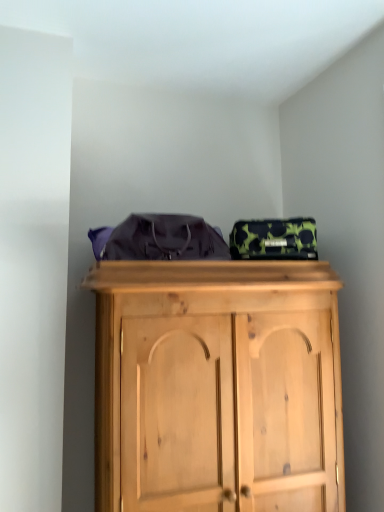
Question: Visually, is matte purple bag at center positioned to the left or to the right of camouflage-patterned fabric bag at upper center?

Choices:
 (A) left
 (B) right

Answer: (A)

Question: Is matte purple bag at center in front of or behind camouflage-patterned fabric bag at upper center in the image?

Choices:
 (A) behind
 (B) front

Answer: (B)

Question: Is matte purple bag at center wider or thinner than camouflage-patterned fabric bag at upper center?

Choices:
 (A) wide
 (B) thin

Answer: (A)

Question: In the image, is camouflage-patterned fabric bag at upper center positioned in front of or behind matte purple bag at center?

Choices:
 (A) front
 (B) behind

Answer: (B)

Question: Is point (294, 245) positioned closer to the camera than point (132, 248)?

Choices:
 (A) closer
 (B) farther

Answer: (B)

Question: Considering the relative positions of camouflage-patterned fabric bag at upper center and matte purple bag at center in the image provided, is camouflage-patterned fabric bag at upper center to the left or to the right of matte purple bag at center?

Choices:
 (A) left
 (B) right

Answer: (B)

Question: In terms of size, does camouflage-patterned fabric bag at upper center appear bigger or smaller than matte purple bag at center?

Choices:
 (A) big
 (B) small

Answer: (B)